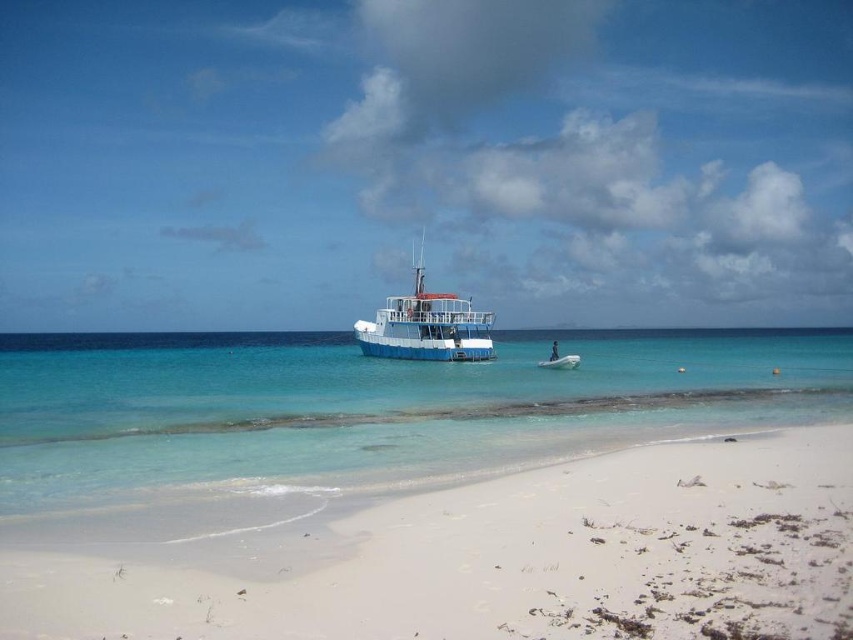
Consider the image. You are standing on the white sandy beach at lower right and want to reach the clear blue water at center. Which direction should you walk to get there?

Since the white sandy beach at lower right is to the left of clear blue water at center, you should walk to the right to reach the clear blue water at center.

You are planning to set up a small tent on the white sandy beach at lower right and the blue matte boat at center. Which location would allow you to place a larger tent?

The blue matte boat at center is larger than the white sandy beach at lower right, so the blue matte boat at center would allow you to place a larger tent.